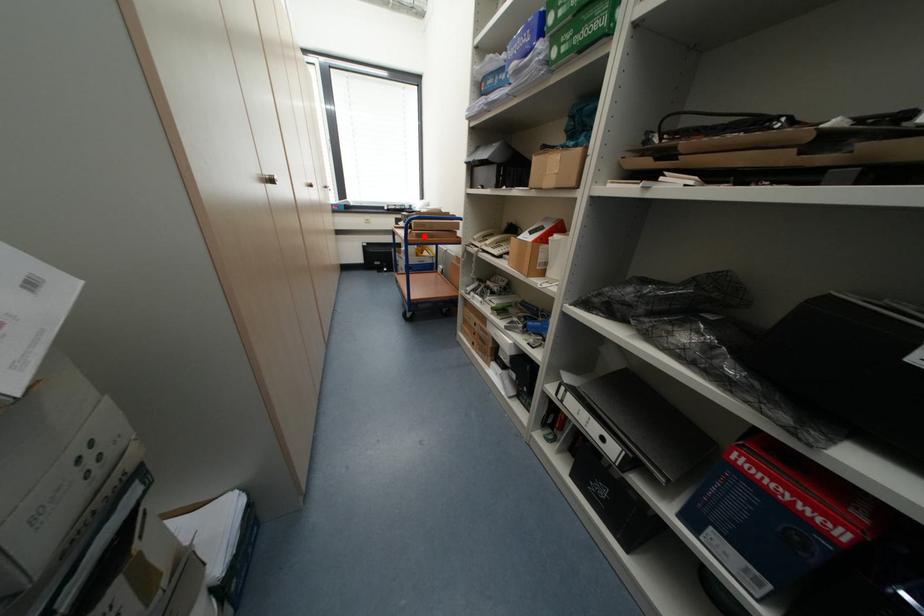
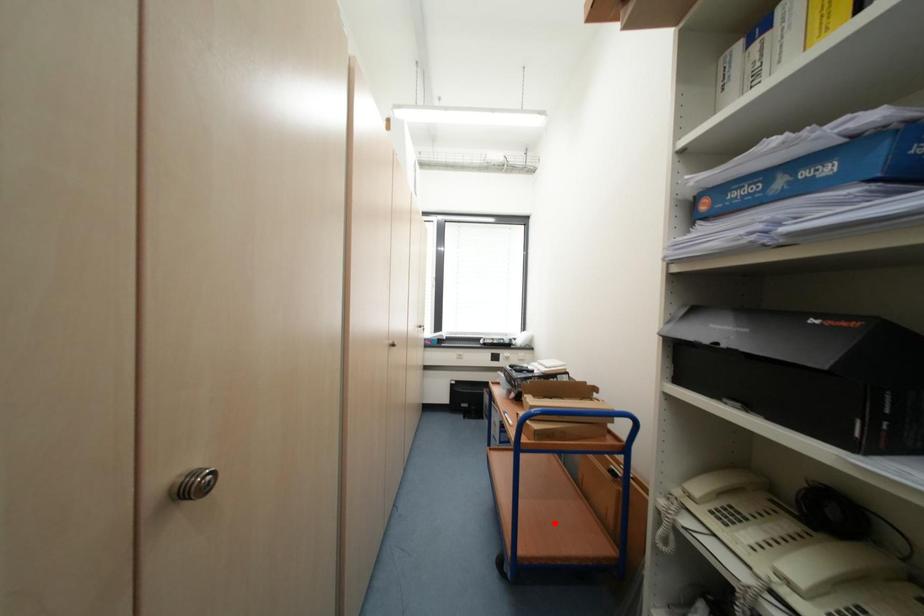
I am providing you with two images of the same scene from different viewpoints. A red point is marked on the first image and another point is marked on the second image. Does the point marked in image1 correspond to the same location as the one in image2?

No